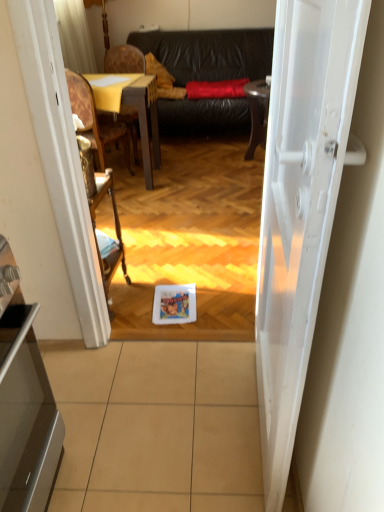
This screenshot has height=512, width=384. What are the coordinates of `unoccupied region to the right of wooden polished chair at left, which is counted as the second chair, starting from the back` in the screenshot? It's located at (159, 185).